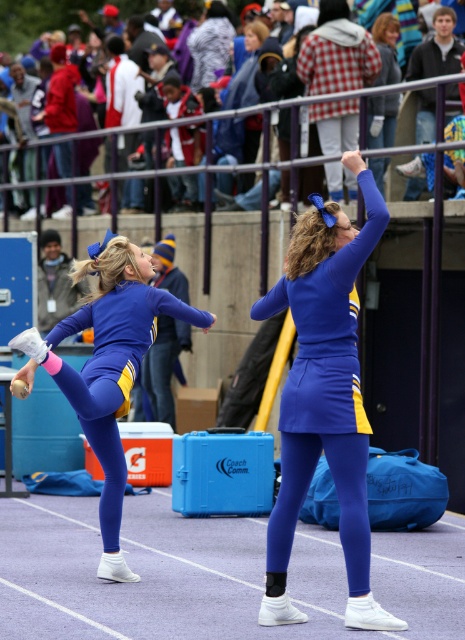
This screenshot has width=465, height=640. Describe the element at coordinates (325, 397) in the screenshot. I see `blue fabric cheerleader at center` at that location.

Between blue fabric cheerleader at center and plaid fabric jacket at upper center, which one has less height?

blue fabric cheerleader at center is shorter.

Who is more distant from viewer, (292, 509) or (64, 202)?

The point (64, 202) is behind.

What are the coordinates of `blue fabric cheerleader at center` in the screenshot? It's located at (325, 397).

Which is behind, point (360, 417) or point (93, 449)?

The point (93, 449) is more distant.

Which of these two, blue fabric cheerleader at center or matte blue uniform at center, stands taller?

blue fabric cheerleader at center

Does point (357, 376) come farther from viewer compared to point (99, 280)?

That is False.

Where is `blue fabric cheerleader at center`? Image resolution: width=465 pixels, height=640 pixels. blue fabric cheerleader at center is located at coordinates (325, 397).

Is point (106, 356) less distant than point (91, 128)?

Yes, it is in front of point (91, 128).

Is point (112, 321) farther from camera compared to point (311, 131)?

No, it is in front of (311, 131).

Locate an element on the screen. matte blue uniform at center is located at coordinates (107, 368).